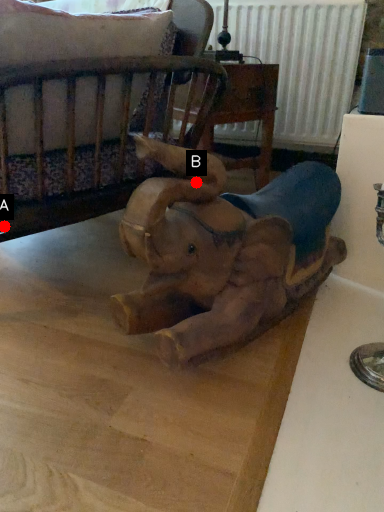
Question: Two points are circled on the image, labeled by A and B beside each circle. Which point appears farthest from the camera in this image?

Choices:
 (A) A is further
 (B) B is further

Answer: (A)